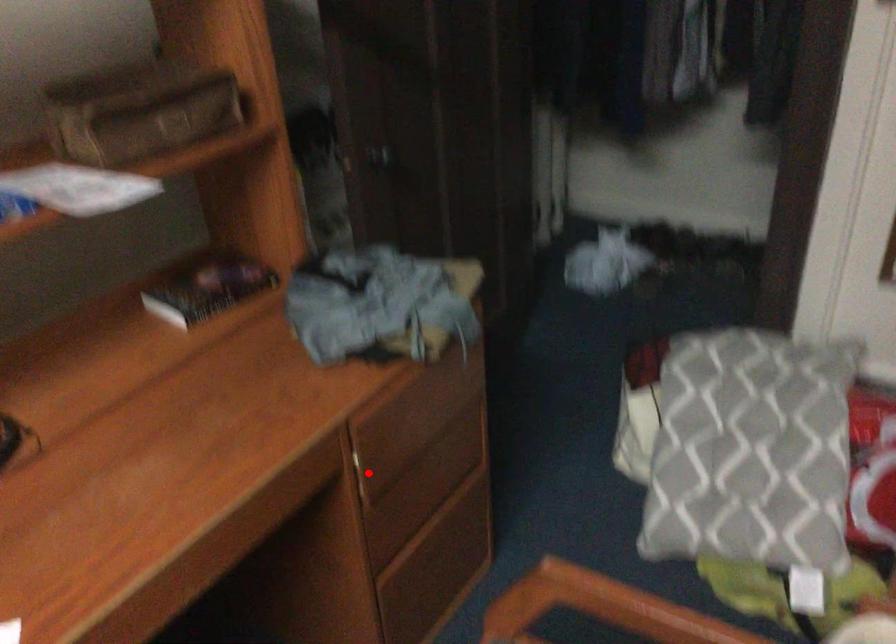
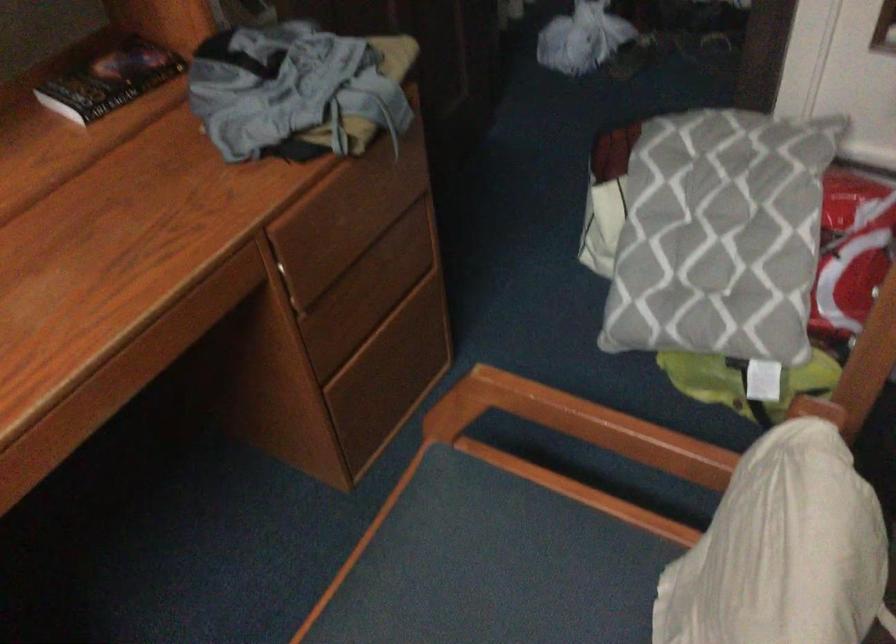
In the second image, find the point that corresponds to the highlighted location in the first image.

(299, 276)